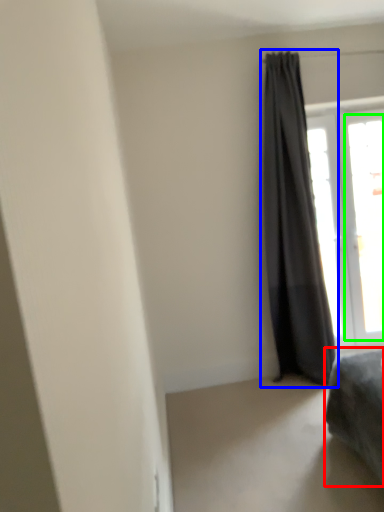
Question: Which object is the closest to the furniture (highlighted by a red box)? Choose among these: curtain (highlighted by a blue box) or window (highlighted by a green box).

Choices:
 (A) curtain
 (B) window

Answer: (A)